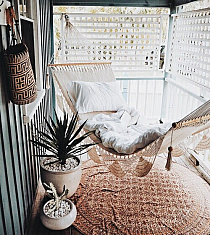
The width and height of the screenshot is (210, 235). Find the location of `spikey plant`. spikey plant is located at coordinates (62, 140).